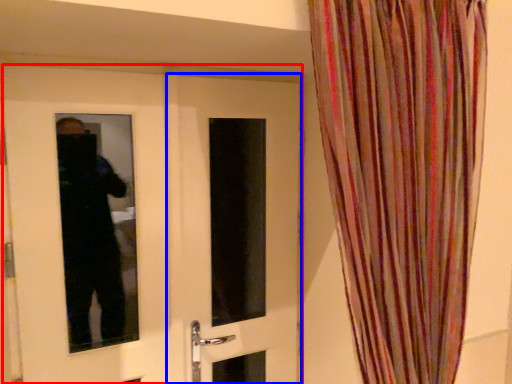
Question: Which object is further to the camera taking this photo, door (highlighted by a red box) or door (highlighted by a blue box)?

Choices:
 (A) door
 (B) door

Answer: (B)